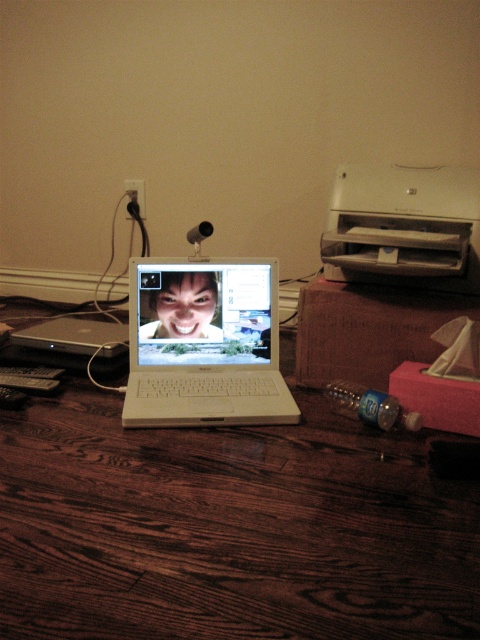
Question: Which object appears closest to the camera in this image?

Choices:
 (A) white plastic laptop at center
 (B) wooden table at center
 (C) white plastic printer at upper right

Answer: (B)

Question: Is white plastic laptop at center further to camera compared to shiny white laptop at center?

Choices:
 (A) no
 (B) yes

Answer: (A)

Question: Which is farther from the white plastic laptop at center?

Choices:
 (A) white plastic printer at upper right
 (B) shiny white laptop at center
 (C) wooden table at center

Answer: (A)

Question: Does white plastic printer at upper right appear on the right side of shiny white laptop at center?

Choices:
 (A) yes
 (B) no

Answer: (A)

Question: Which object appears farthest from the camera in this image?

Choices:
 (A) white plastic printer at upper right
 (B) white plastic laptop at center
 (C) wooden table at center
 (D) shiny white laptop at center

Answer: (D)

Question: Is wooden table at center to the right of white plastic printer at upper right from the viewer's perspective?

Choices:
 (A) no
 (B) yes

Answer: (A)